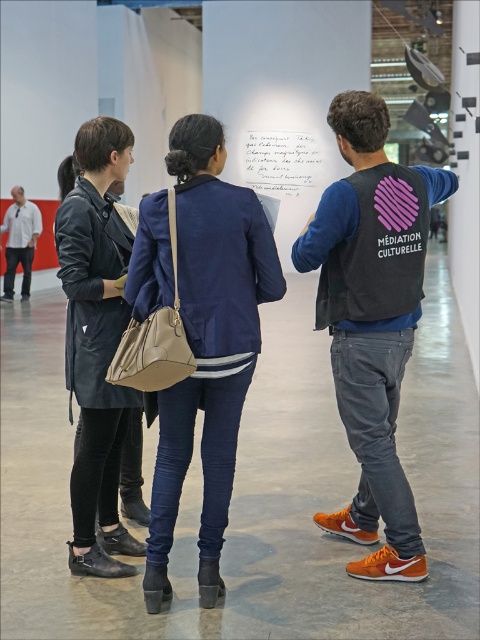
Question: Does black fabric vest at center come in front of white shirt at left?

Choices:
 (A) no
 (B) yes

Answer: (B)

Question: Which of the following is the closest to the observer?

Choices:
 (A) (264, 192)
 (B) (39, 224)

Answer: (B)

Question: Considering the relative positions of black fabric vest at center and white shirt at left in the image provided, where is black fabric vest at center located with respect to white shirt at left?

Choices:
 (A) right
 (B) left

Answer: (A)

Question: Can you confirm if navy blue fabric jacket at center is thinner than black fabric vest at center?

Choices:
 (A) yes
 (B) no

Answer: (A)

Question: Among these points, which one is farthest from the camera?

Choices:
 (A) (223, 500)
 (B) (278, 131)
 (C) (31, 202)

Answer: (B)

Question: Which of these objects is positioned farthest from the leather jacket at left?

Choices:
 (A) white shirt at left
 (B) black fabric vest at center
 (C) white paper at center

Answer: (C)